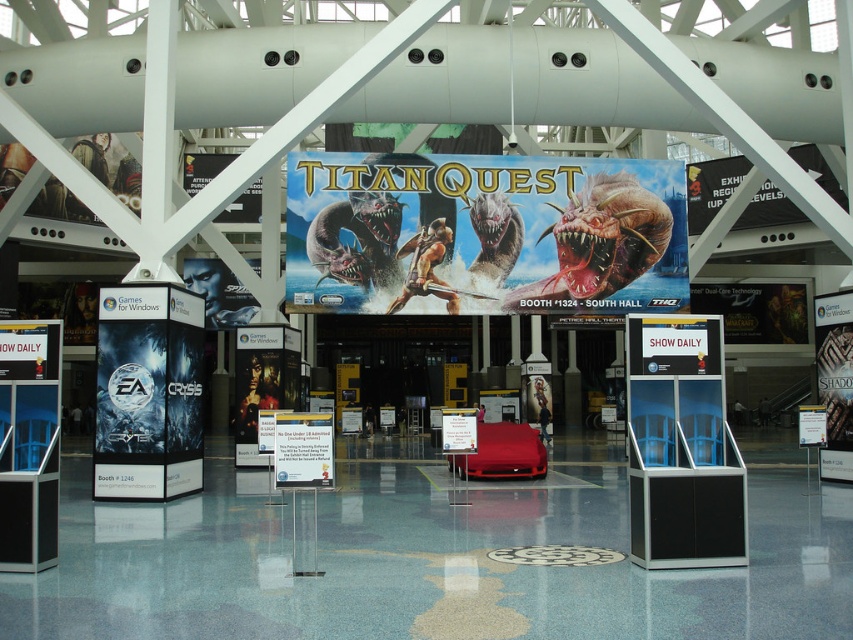
You are standing in the exhibition hall and want to locate two points marked on the floor. The first point is at coordinate point (572, 253) and the second is at coordinate point (288, 435). Which point is closer to you as you face the banner?

Point (572, 253) is closer to you because it is further to the viewer than point (288, 435).

You are attending a convention and want to locate the Titan Quest booth. You see the metallic blue banner at center and the white paper sign at center. Which one should you look at to find the booth number?

The metallic blue banner at center is bigger than the white paper sign at center, so you should look at the metallic blue banner at center to find the booth number since it likely contains the larger display with the necessary information.